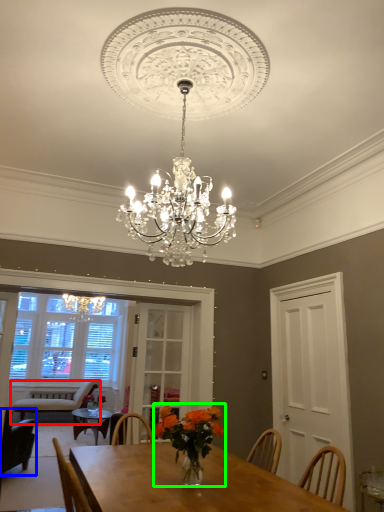
Question: Based on their relative distances, which object is nearer to chair (highlighted by a red box)? Choose from chair (highlighted by a blue box) and floral arrangement (highlighted by a green box).

Choices:
 (A) chair
 (B) floral arrangement

Answer: (A)